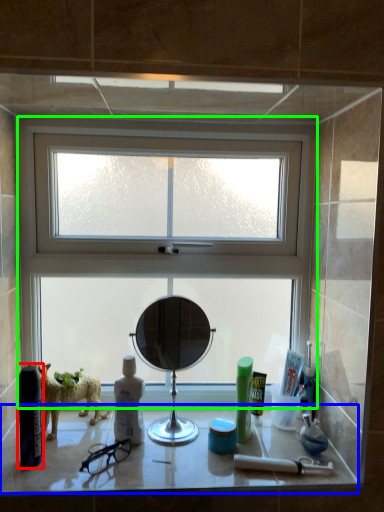
Question: Which object is positioned closest to cleaning product (highlighted by a red box)? Select from counter top (highlighted by a blue box) and window (highlighted by a green box).

Choices:
 (A) counter top
 (B) window

Answer: (A)